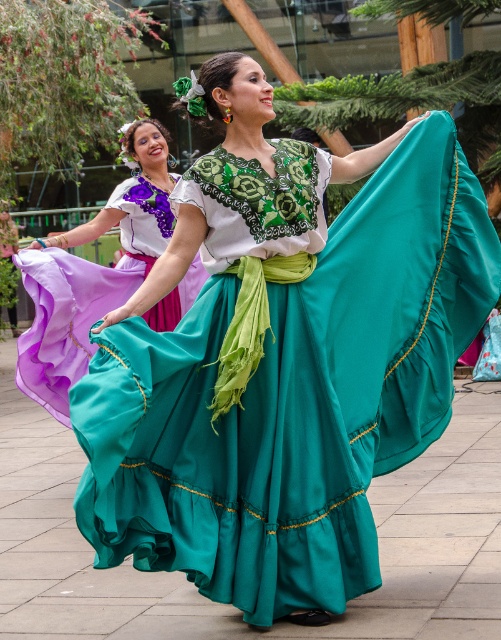
You are a photographer at the event and want to capture a photo where both the teal satin dress at center and the matte purple skirt at left are clearly visible. Given their height difference, which object should you focus on to ensure both are in frame without cropping?

The teal satin dress at center is much taller than the matte purple skirt at left, so focusing on the teal satin dress at center would ensure both are in frame without cropping.

You are a photographer standing at the edge of the stage. You need to capture a photo that includes both the teal satin dress at center and the matte purple skirt at left. The minimum distance between the two subjects for the camera to focus properly is 8 feet. Will you be able to achieve this?

The teal satin dress at center is 8.14 feet from the matte purple skirt at left, which exceeds the minimum required distance of 8 feet. Therefore, the photographer can achieve proper focus on both subjects.

You are a photographer at the event and want to capture a photo where both the teal satin dress at center and the matte purple skirt at left are fully visible. Based on their positions, which dress should be moved and in which direction to ensure both are fully visible in the frame?

The teal satin dress at center is positioned under the matte purple skirt at left. To ensure both are fully visible, the matte purple skirt at left should be moved to the right so that it no longer blocks the teal satin dress at center.